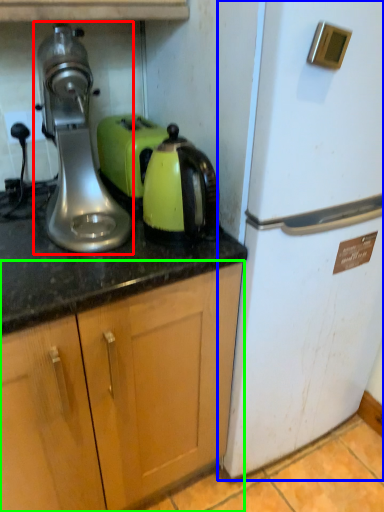
Question: Based on their relative distances, which object is farther from home appliance (highlighted by a red box)? Choose from refrigerator (highlighted by a blue box) and cabinetry (highlighted by a green box).

Choices:
 (A) refrigerator
 (B) cabinetry

Answer: (A)